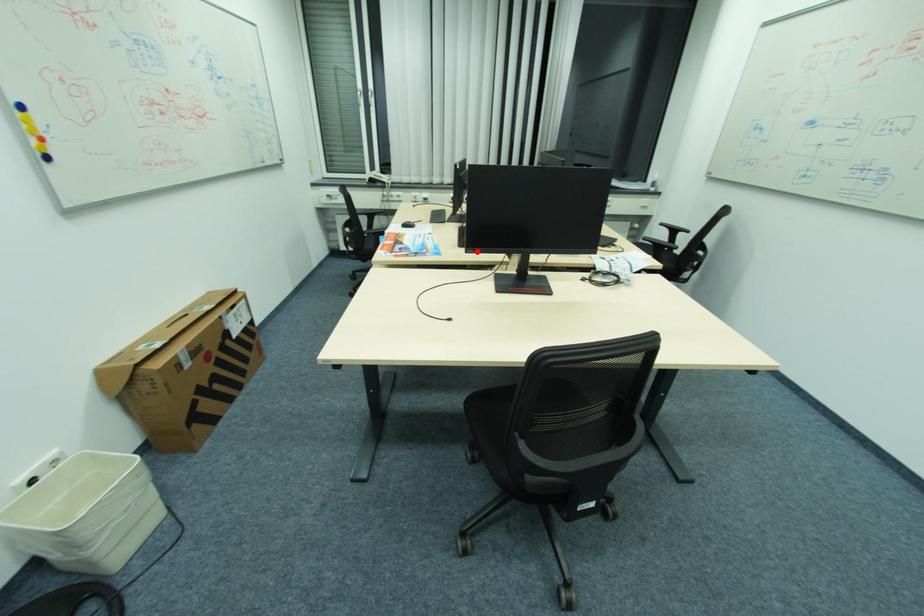
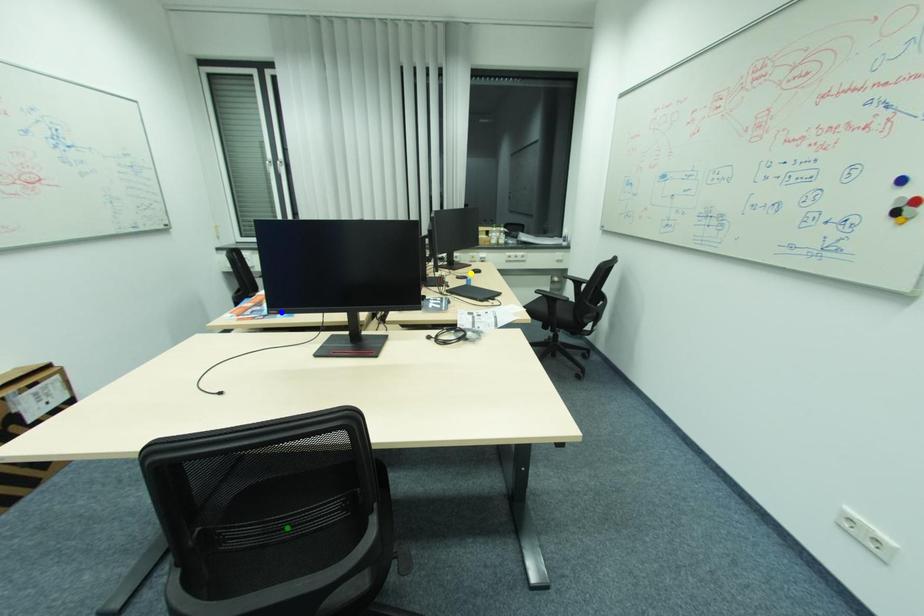
Question: I am providing you with two images of the same scene from different viewpoints. A red point is marked on the first image. You are given multiple points on the second image. Which mark in image 2 goes with the point in image 1?

Choices:
 (A) blue point
 (B) green point
 (C) yellow point

Answer: (A)